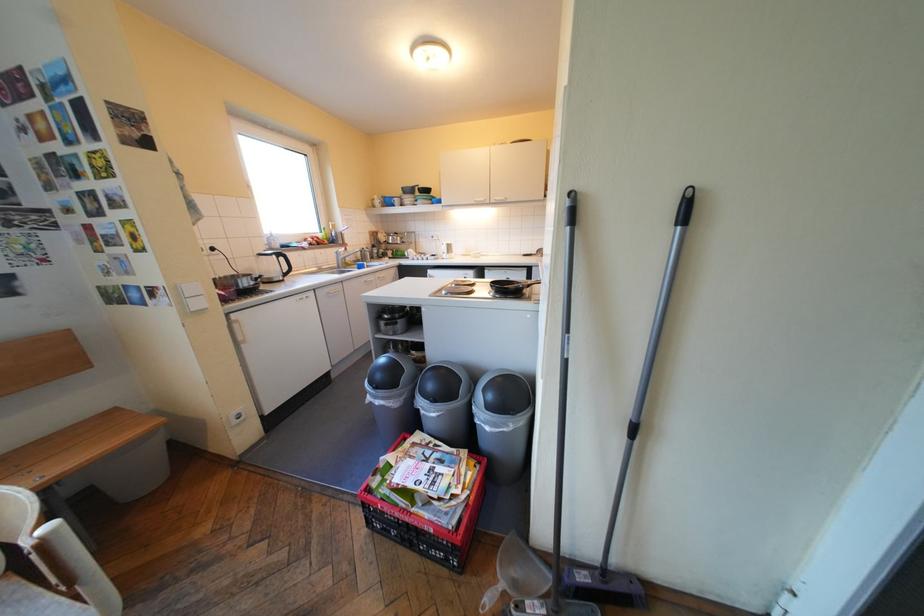
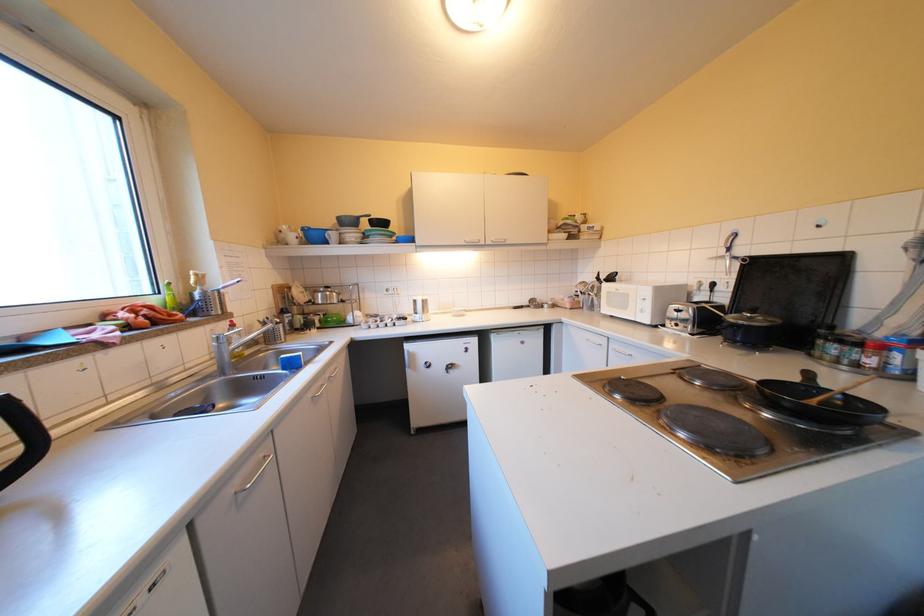
In a continuous first-person perspective shot, in which direction is the camera moving?

The cameraman moved toward left, forward.